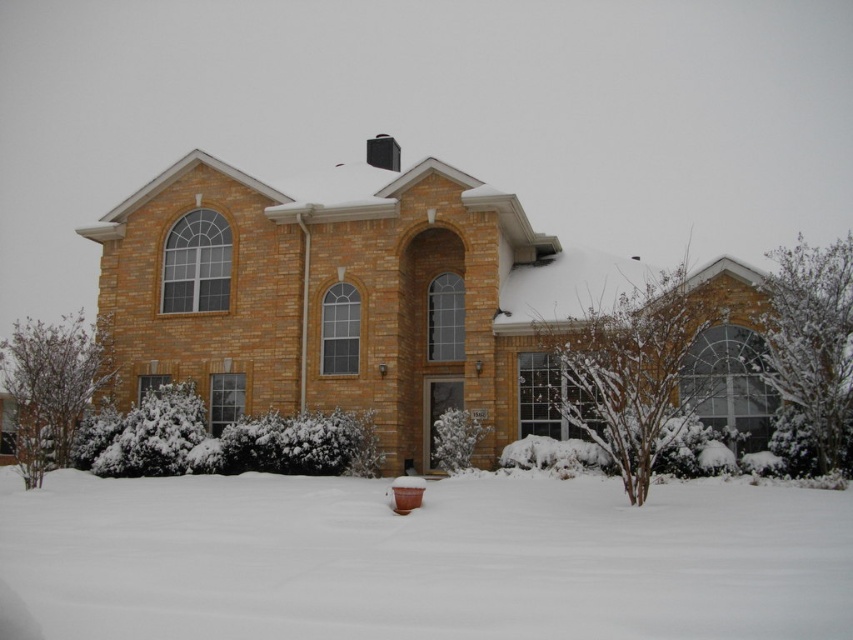
From the picture: You are standing in the front yard of the house depicted in the image. There is a point marked at coordinates (422, 557). What is located at this point?

The point at coordinates (422, 557) corresponds to the white fluffy snow at lower center.

You are a delivery person trying to reach the front door of the brown brick house at center. There is white fluffy snow at lower center in your path. Can you walk directly to the house without stepping on the snow?

The white fluffy snow at lower center is positioned under the brown brick house at center, so the snow is actually under the house and not blocking the path. You can walk directly to the house without stepping on the snow.

You are standing at the center of the front yard and want to place a snowman using two snowballs. The first snowball should be placed at point (294, 273) and the second at point (369, 141). Which snowball should be placed lower to the ground?

Point (294, 273) is in front of point (369, 141), so the snowball at point (294, 273) should be placed lower to the ground because it is closer to the viewer.